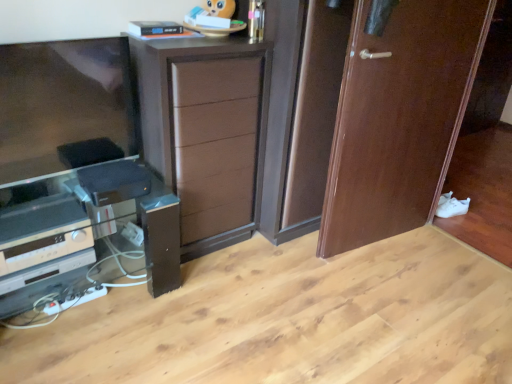
What do you see at coordinates (91, 236) in the screenshot? I see `black glossy speaker at lower left` at bounding box center [91, 236].

What do you see at coordinates (41, 248) in the screenshot? I see `silver metallic stereo at lower left` at bounding box center [41, 248].

What do you see at coordinates (399, 118) in the screenshot? The width and height of the screenshot is (512, 384). I see `wooden door at right` at bounding box center [399, 118].

Locate an element on the screen. The image size is (512, 384). white matte shoe at lower right is located at coordinates [x=453, y=208].

You are a GUI agent. You are given a task and a screenshot of the screen. Output one action in this format:
    pyautogui.click(x=<x>, y=<y>)
    Task: Click on the black glossy speaker at lower left
    This screenshot has height=384, width=512.
    Given the screenshot: What is the action you would take?
    (x=91, y=236)

Are brown wood chest of drawers at center and black glossy speaker at lower left beside each other?

brown wood chest of drawers at center and black glossy speaker at lower left are clearly separated.

Based on their positions, is brown wood chest of drawers at center located to the left or right of black glossy speaker at lower left?

brown wood chest of drawers at center is positioned on black glossy speaker at lower left's right side.

Find the location of a particular element. This screenshot has height=384, width=512. computer desk on the left side of brown wood chest of drawers at center is located at coordinates [x=91, y=236].

Who is more distant, white matte shoe at lower right or black glossy speaker at lower left?

white matte shoe at lower right is more distant.

Would you say black glossy speaker at lower left is part of white matte shoe at lower right's contents?

No.

Could you tell me if white matte shoe at lower right is turned towards black glossy speaker at lower left?

Yes, white matte shoe at lower right is facing black glossy speaker at lower left.

Which object is wider, white matte shoe at lower right or black glossy speaker at lower left?

With larger width is black glossy speaker at lower left.

Looking at this image, is wooden door at right wider than white matte shoe at lower right?

No.

Is wooden door at right positioned with its back to white matte shoe at lower right?

No, white matte shoe at lower right is not at the back of wooden door at right.

From the image's perspective, between wooden door at right and white matte shoe at lower right, which one is located above?

wooden door at right.

In the scene shown: Considering their positions, is wooden door at right located in front of or behind white matte shoe at lower right?

wooden door at right is in front of white matte shoe at lower right.

Considering the sizes of objects white matte shoe at lower right and wooden door at right in the image provided, who is thinner, white matte shoe at lower right or wooden door at right?

Thinner between the two is wooden door at right.

Looking at this image, from the image's perspective, is white matte shoe at lower right on wooden door at right?

No, from the image's perspective, white matte shoe at lower right is not over wooden door at right.

Find the location of a particular element. This screenshot has width=512, height=384. shoe lying behind the wooden door at right is located at coordinates click(x=453, y=208).

From the image's perspective, which one is positioned higher, white matte shoe at lower right or silver metallic stereo at lower left?

white matte shoe at lower right.

Does point (456, 200) come closer to viewer compared to point (70, 233)?

No, (456, 200) is further to viewer.

Considering the sizes of objects white matte shoe at lower right and silver metallic stereo at lower left in the image provided, who is thinner, white matte shoe at lower right or silver metallic stereo at lower left?

With smaller width is white matte shoe at lower right.

Considering the relative sizes of white matte shoe at lower right and silver metallic stereo at lower left in the image provided, is white matte shoe at lower right shorter than silver metallic stereo at lower left?

Indeed, white matte shoe at lower right has a lesser height compared to silver metallic stereo at lower left.

Is brown wood chest of drawers at center not close to white matte shoe at lower right?

Absolutely, brown wood chest of drawers at center is distant from white matte shoe at lower right.

Considering the relative positions of brown wood chest of drawers at center and white matte shoe at lower right in the image provided, is brown wood chest of drawers at center behind white matte shoe at lower right?

No, the depth of brown wood chest of drawers at center is less than that of white matte shoe at lower right.

Can you confirm if brown wood chest of drawers at center is taller than white matte shoe at lower right?

Yes.

Is black glossy speaker at lower left positioned with its back to wooden door at right?

black glossy speaker at lower left is not turned away from wooden door at right.

Considering the sizes of objects black glossy speaker at lower left and wooden door at right in the image provided, who is wider, black glossy speaker at lower left or wooden door at right?

Wider between the two is black glossy speaker at lower left.

Consider the image. In the image, is black glossy speaker at lower left positioned in front of or behind wooden door at right?

black glossy speaker at lower left is in front of wooden door at right.

From a real-world perspective, is black glossy speaker at lower left positioned above or below wooden door at right?

Clearly, from a real-world perspective, black glossy speaker at lower left is below wooden door at right.

The width and height of the screenshot is (512, 384). There is a black glossy speaker at lower left. What are the coordinates of `the chest of drawers above it (from a real-world perspective)` in the screenshot? It's located at (206, 132).

Find the location of a particular element. This screenshot has height=384, width=512. computer desk in front of the white matte shoe at lower right is located at coordinates (91, 236).

Looking at the image, which one is located further to brown wood chest of drawers at center, silver metallic stereo at lower left or black glossy speaker at lower left?

silver metallic stereo at lower left is further to brown wood chest of drawers at center.

From the image, which object appears to be nearer to wooden door at right, white matte shoe at lower right or brown wood chest of drawers at center?

Based on the image, brown wood chest of drawers at center appears to be nearer to wooden door at right.

Based on their spatial positions, is black glossy speaker at lower left or silver metallic stereo at lower left closer to wooden door at right?

black glossy speaker at lower left is positioned closer to the anchor wooden door at right.

Which object lies nearer to the anchor point black glossy speaker at lower left, brown wood chest of drawers at center or silver metallic stereo at lower left?

silver metallic stereo at lower left lies closer to black glossy speaker at lower left than the other object.

When comparing their distances from brown wood chest of drawers at center, does white matte shoe at lower right or black glossy speaker at lower left seem closer?

black glossy speaker at lower left lies closer to brown wood chest of drawers at center than the other object.

When comparing their distances from black glossy speaker at lower left, does white matte shoe at lower right or silver metallic stereo at lower left seem closer?

silver metallic stereo at lower left is closer to black glossy speaker at lower left.

From the image, which object appears to be nearer to white matte shoe at lower right, brown wood chest of drawers at center or wooden door at right?

Among the two, wooden door at right is located nearer to white matte shoe at lower right.

Estimate the real-world distances between objects in this image. Which object is closer to white matte shoe at lower right, wooden door at right or brown wood chest of drawers at center?

wooden door at right is closer to white matte shoe at lower right.

You are a GUI agent. You are given a task and a screenshot of the screen. Output one action in this format:
    pyautogui.click(x=<x>, y=<y>)
    Task: Click on the chest of drawers situated between black glossy speaker at lower left and wooden door at right from left to right
    
    Given the screenshot: What is the action you would take?
    pyautogui.click(x=206, y=132)

The width and height of the screenshot is (512, 384). I want to click on chest of drawers between silver metallic stereo at lower left and white matte shoe at lower right from left to right, so click(206, 132).

Locate an element on the screen. This screenshot has width=512, height=384. door between silver metallic stereo at lower left and white matte shoe at lower right from left to right is located at coordinates (399, 118).

Image resolution: width=512 pixels, height=384 pixels. I want to click on computer desk situated between silver metallic stereo at lower left and wooden door at right from left to right, so point(91,236).